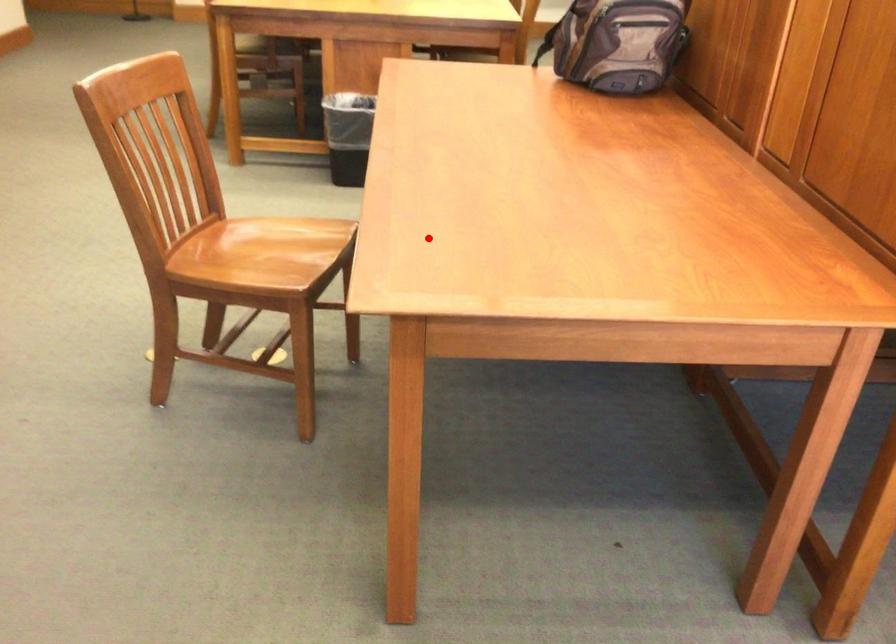
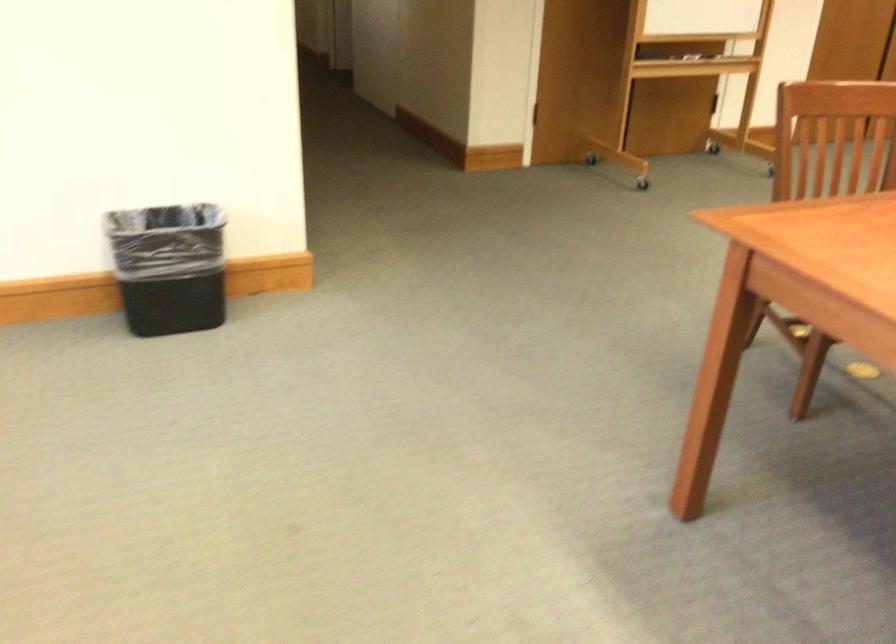
Where in the second image is the point corresponding to the highlighted location from the first image?

(849, 220)